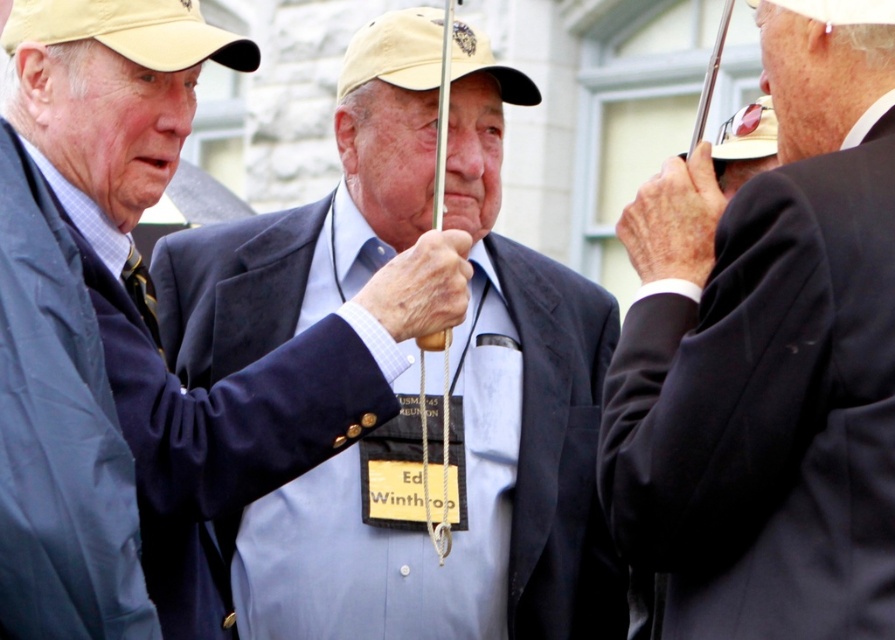
You are standing at the point with coordinates point (827,148) and want to walk to the point with coordinates point (126,236). Based on the scene description, which direction should you move relative to the other point?

Point (827,148) is in front of point (126,236), so you should move backward to reach point (126,236).

You are standing at the point with coordinates point (134,282) and want to walk to the point with coordinates point (139,557). Which direction should you go?

You should walk forward because point (139,557) is in front of point (134,282).